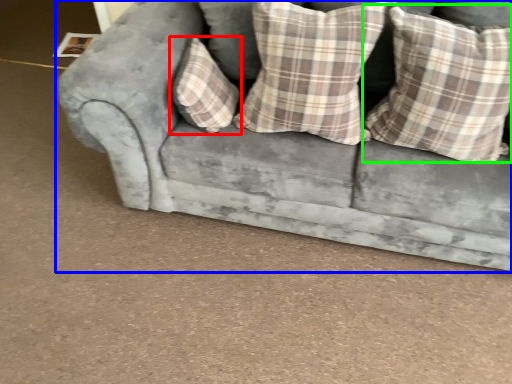
Question: Estimate the real-world distances between objects in this image. Which object is farther from pillow (highlighted by a red box), studio couch (highlighted by a blue box) or pillow (highlighted by a green box)?

Choices:
 (A) studio couch
 (B) pillow

Answer: (B)